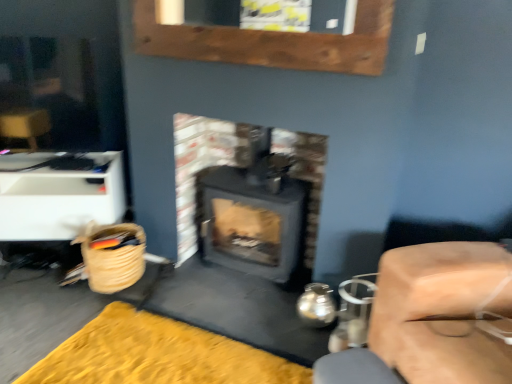
Question: Would you consider white plastic drawer at left, which is counted as the second furniture, starting from the front, to be distant from woven straw basket at lower left?

Choices:
 (A) yes
 (B) no

Answer: (B)

Question: Is white plastic drawer at left, acting as the 1th furniture starting from the back, facing away from woven straw basket at lower left?

Choices:
 (A) no
 (B) yes

Answer: (A)

Question: Does white plastic drawer at left, which is counted as the first furniture, starting from the left, have a greater width compared to woven straw basket at lower left?

Choices:
 (A) yes
 (B) no

Answer: (A)

Question: Does white plastic drawer at left, which is counted as the second furniture, starting from the front, lie in front of woven straw basket at lower left?

Choices:
 (A) yes
 (B) no

Answer: (B)

Question: Can you see white plastic drawer at left, which is counted as the first furniture, starting from the left, touching woven straw basket at lower left?

Choices:
 (A) yes
 (B) no

Answer: (B)

Question: Looking at the image, does white plastic drawer at left, arranged as the second furniture when viewed from the right, seem bigger or smaller compared to yellow plush rug at lower left?

Choices:
 (A) small
 (B) big

Answer: (B)

Question: From a real-world perspective, is white plastic drawer at left, arranged as the second furniture when viewed from the right, positioned above or below yellow plush rug at lower left?

Choices:
 (A) below
 (B) above

Answer: (B)

Question: Would you say white plastic drawer at left, acting as the 1th furniture starting from the back, is inside or outside yellow plush rug at lower left?

Choices:
 (A) inside
 (B) outside

Answer: (B)

Question: Relative to yellow plush rug at lower left, is white plastic drawer at left, which is counted as the second furniture, starting from the front, in front or behind?

Choices:
 (A) front
 (B) behind

Answer: (B)

Question: Would you say yellow plush rug at lower left is to the left or to the right of woven straw basket at lower left in the picture?

Choices:
 (A) left
 (B) right

Answer: (B)

Question: From the image's perspective, is yellow plush rug at lower left above or below woven straw basket at lower left?

Choices:
 (A) below
 (B) above

Answer: (A)

Question: Looking at the image, does yellow plush rug at lower left seem bigger or smaller compared to woven straw basket at lower left?

Choices:
 (A) small
 (B) big

Answer: (B)

Question: Is point (109, 340) closer or farther from the camera than point (89, 221)?

Choices:
 (A) farther
 (B) closer

Answer: (B)

Question: Based on their positions, is yellow plush rug at lower left located to the left or right of white plastic drawer at left, which is counted as the second furniture, starting from the front?

Choices:
 (A) left
 (B) right

Answer: (B)

Question: Looking at their shapes, would you say yellow plush rug at lower left is wider or thinner than white plastic drawer at left, which is counted as the second furniture, starting from the front?

Choices:
 (A) wide
 (B) thin

Answer: (A)